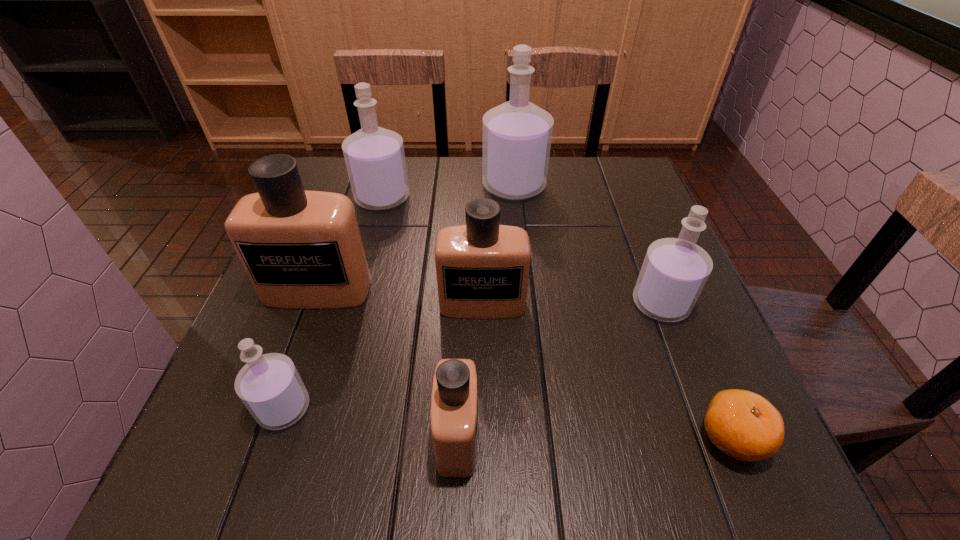
The height and width of the screenshot is (540, 960). I want to click on orange clementine, so click(x=744, y=425).

I want to click on vacant region located 0.180m on the right of the biggest purple perfume, so click(x=612, y=186).

Where is `free space located on the back of the third smallest purple perfume`? The image size is (960, 540). free space located on the back of the third smallest purple perfume is located at coordinates (389, 173).

This screenshot has width=960, height=540. I want to click on free space located on the front label of the biggest beige perfume, so (x=252, y=477).

Where is `vacant space located 0.320m on the back of the rightmost perfume`? vacant space located 0.320m on the back of the rightmost perfume is located at coordinates (619, 197).

The image size is (960, 540). Identify the location of free spot located 0.130m on the front label of the second smallest beige perfume. (483, 376).

Locate an element on the screen. This screenshot has width=960, height=540. vacant area situated 0.110m on the right of the smallest purple perfume is located at coordinates (375, 408).

This screenshot has width=960, height=540. Identify the location of free space located on the front label of the smallest beige perfume. (578, 436).

In order to click on vacant space located on the back of the orange clementine in this screenshot , I will do `click(700, 361)`.

The height and width of the screenshot is (540, 960). In order to click on perfume that is positioned at the near edge in this screenshot , I will do `click(454, 401)`.